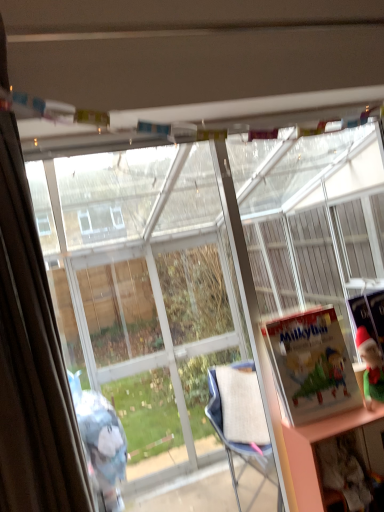
Question: Is matte paper book at right, placed as the first book when sorted from front to back, inside or outside of matte green book at right, which appears as the 1th book when viewed from the right?

Choices:
 (A) inside
 (B) outside

Answer: (B)

Question: In terms of width, does matte paper book at right, placed as the first book when sorted from front to back, look wider or thinner when compared to matte green book at right, which appears as the 1th book when viewed from the right?

Choices:
 (A) thin
 (B) wide

Answer: (B)

Question: Which of these objects is positioned farthest from the matte green book at right, which is counted as the 2th book, starting from the front?

Choices:
 (A) matte paper book at right, marked as the first book in a left-to-right arrangement
 (B) transparent glass bay window at center
 (C) brown fabric curtain at left

Answer: (B)

Question: Which object is positioned closest to the transparent glass bay window at center?

Choices:
 (A) matte green book at right, which is counted as the 2th book, starting from the front
 (B) brown fabric curtain at left
 (C) matte paper book at right, marked as the first book in a left-to-right arrangement

Answer: (C)